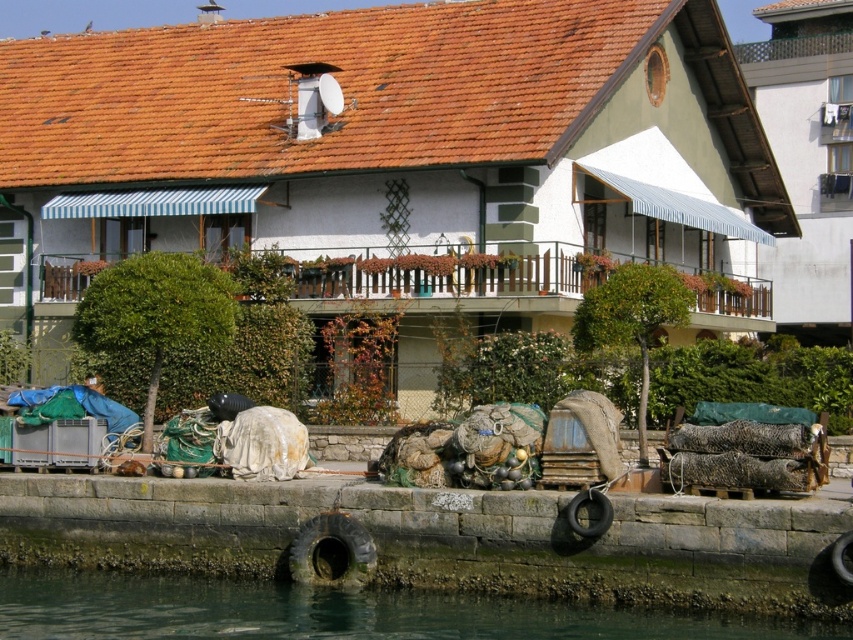
Is point (602, 561) in front of point (196, 577)?

Yes, point (602, 561) is in front of point (196, 577).

In the scene shown: Does dark gray stone dock at lower center have a lesser width compared to clear water at lower left?

No, dark gray stone dock at lower center is not thinner than clear water at lower left.

At what (x,y) coordinates should I click in order to perform the action: click on dark gray stone dock at lower center. Please return your answer as a coordinate pair (x, y). This screenshot has height=640, width=853. Looking at the image, I should click on (433, 536).